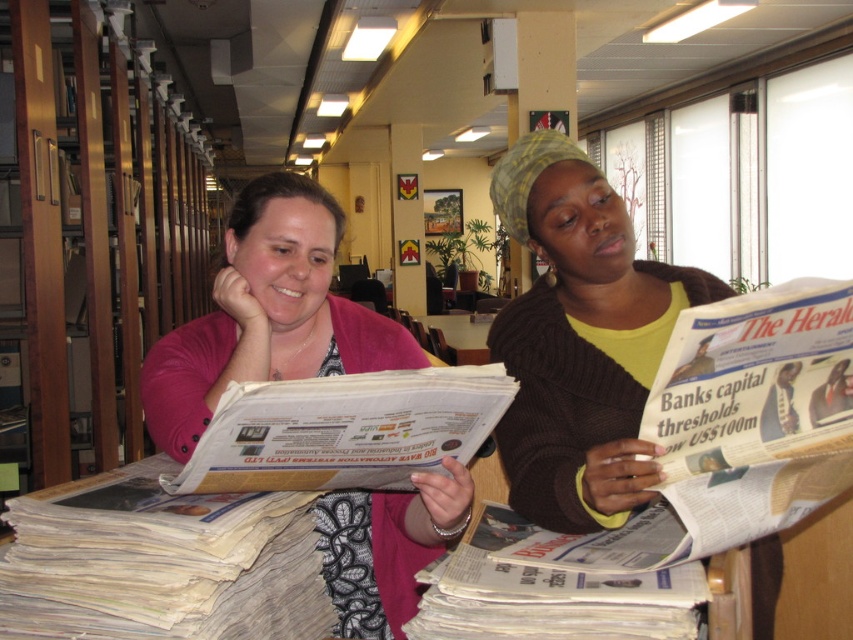
Question: Among these objects, which one is farthest from the camera?

Choices:
 (A) pink fabric at center
 (B) white glossy newspaper at center
 (C) brown knitted sweater at center

Answer: (A)

Question: Which object appears closest to the camera in this image?

Choices:
 (A) pink fabric at center
 (B) white glossy newspaper at center

Answer: (B)

Question: Is brown knitted sweater at center above pink fabric at center?

Choices:
 (A) no
 (B) yes

Answer: (B)

Question: Based on their relative distances, which object is nearer to the pink fabric at center?

Choices:
 (A) white glossy newspaper at center
 (B) brown knitted sweater at center

Answer: (A)

Question: Is brown knitted sweater at center positioned before pink fabric at center?

Choices:
 (A) no
 (B) yes

Answer: (B)

Question: Is brown knitted sweater at center to the left of white glossy newspaper at center from the viewer's perspective?

Choices:
 (A) yes
 (B) no

Answer: (B)